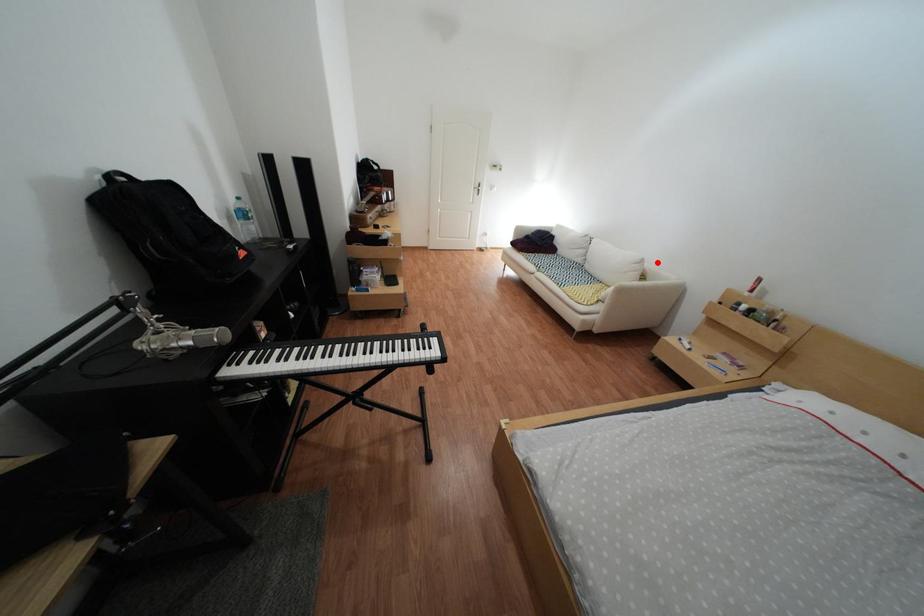
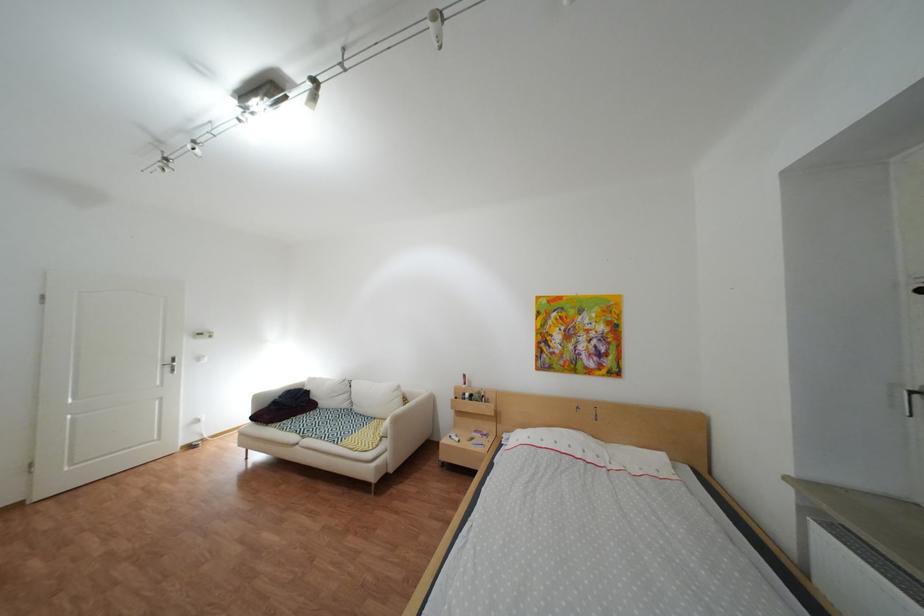
Question: A red point is marked in image1. In image2, is the corresponding 3D point closer to the camera or farther? Reply with the corresponding letter.

Choices:
 (A) The corresponding 3D point is closer.
 (B) The corresponding 3D point is farther.

Answer: (B)